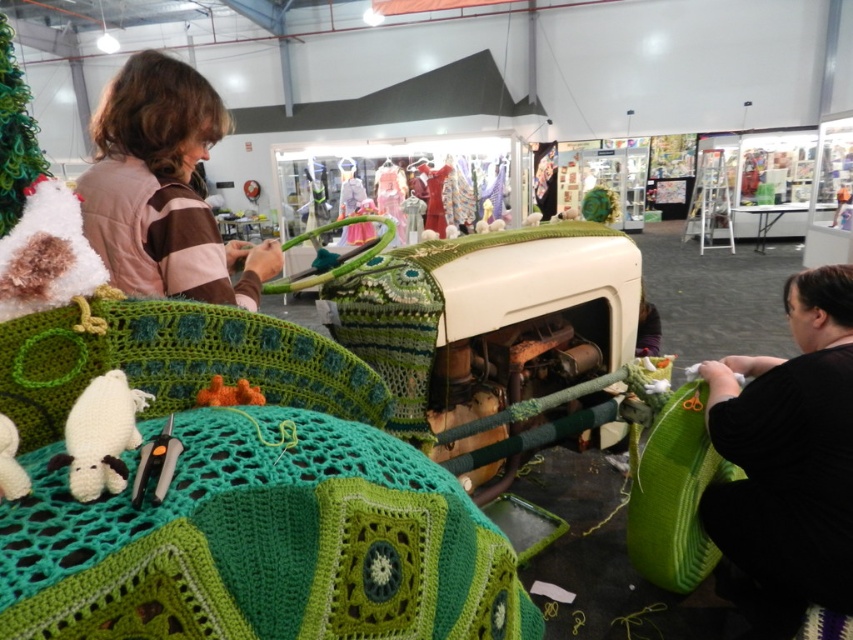
Question: Does green crocheted blanket at lower left have a larger size compared to fuzzy orange toy at center?

Choices:
 (A) yes
 (B) no

Answer: (A)

Question: Among these points, which one is nearest to the camera?

Choices:
 (A) (248, 387)
 (B) (848, 339)
 (C) (120, 416)
 (D) (10, 456)

Answer: (D)

Question: Which point is farther to the camera?

Choices:
 (A) black fabric at lower right
 (B) white yarn stuffed animal at lower left
 (C) white plush sheep at lower left

Answer: (A)

Question: Does green crocheted blanket at lower left come in front of black fabric at lower right?

Choices:
 (A) yes
 (B) no

Answer: (A)

Question: Does white yarn stuffed animal at lower left come behind fuzzy orange toy at center?

Choices:
 (A) yes
 (B) no

Answer: (B)

Question: Which object appears farthest from the camera in this image?

Choices:
 (A) black fabric at lower right
 (B) green crocheted blanket at lower left
 (C) fuzzy orange toy at center

Answer: (A)